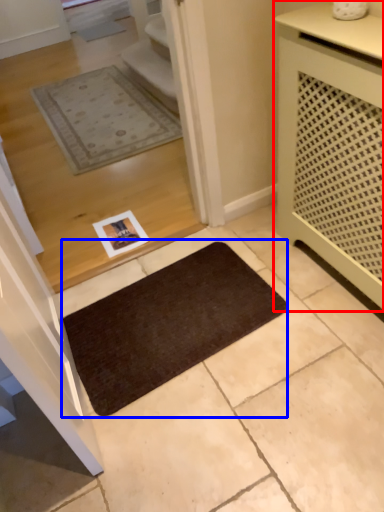
Question: Which point is further to the camera, cabinetry (highlighted by a red box) or mat (highlighted by a blue box)?

Choices:
 (A) cabinetry
 (B) mat

Answer: (B)